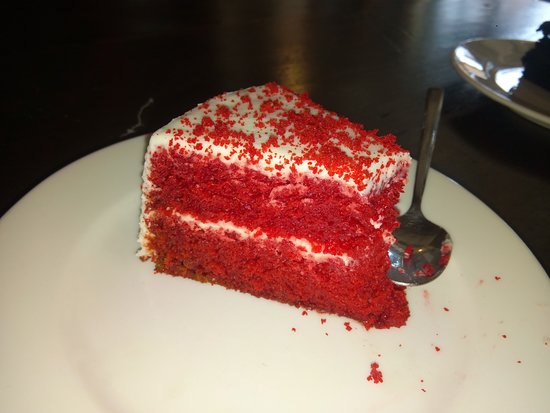
Where is `white plate`? This screenshot has height=413, width=550. white plate is located at coordinates (499, 81), (153, 341).